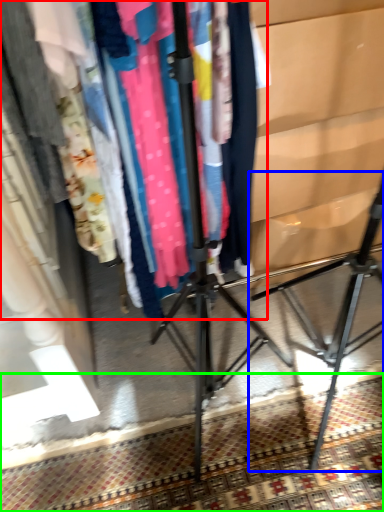
Question: Estimate the real-world distances between objects in this image. Which object is closer to closet (highlighted by a red box), tripod (highlighted by a blue box) or mat (highlighted by a green box)?

Choices:
 (A) tripod
 (B) mat

Answer: (B)